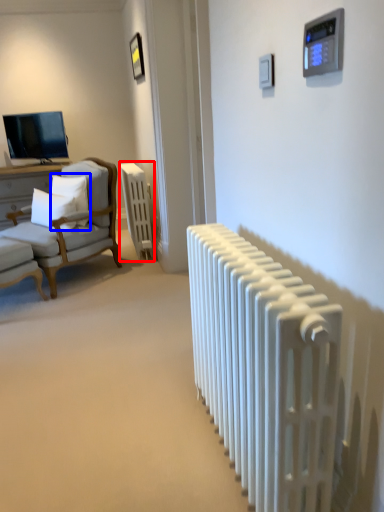
Question: Among these objects, which one is nearest to the camera, radiator (highlighted by a red box) or pillow (highlighted by a blue box)?

Choices:
 (A) radiator
 (B) pillow

Answer: (B)